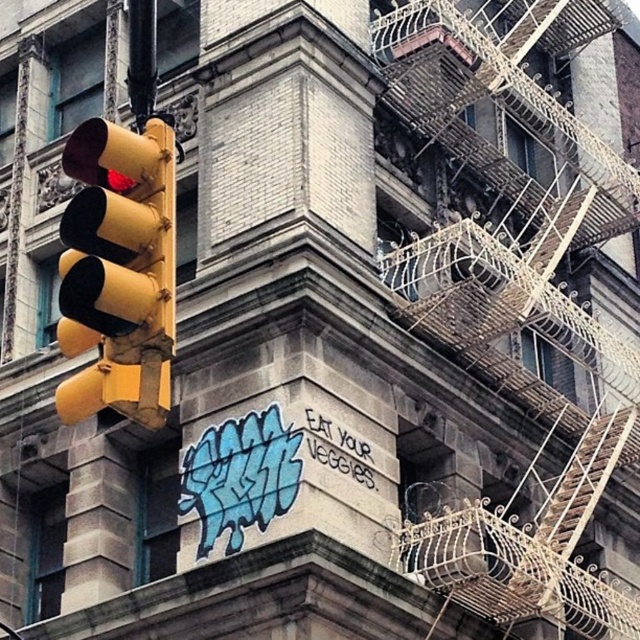
The image size is (640, 640). Find the location of `rustic metal fire escape at right`. rustic metal fire escape at right is located at coordinates coord(516,316).

Does rustic metal fire escape at right have a larger size compared to yellow matte traffic light at left?

Correct, rustic metal fire escape at right is larger in size than yellow matte traffic light at left.

Identify the location of rustic metal fire escape at right. This screenshot has height=640, width=640. (516, 316).